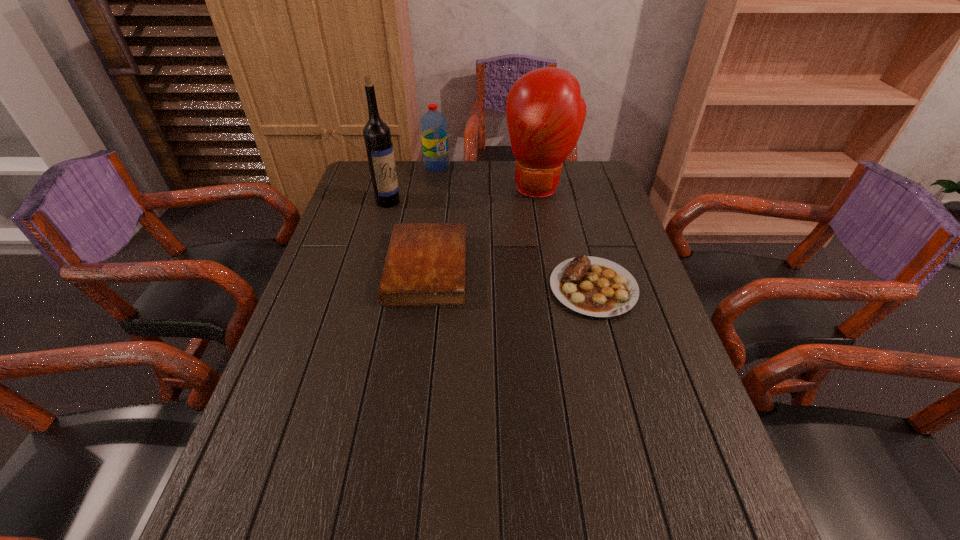
Find the location of `water bottle that is positioned at the far edge`. water bottle that is positioned at the far edge is located at coordinates (434, 133).

Locate an element on the screen. Image resolution: width=960 pixels, height=540 pixels. object that is positioned at the left edge is located at coordinates (379, 147).

This screenshot has height=540, width=960. I want to click on steak that is at the right edge, so click(592, 286).

The image size is (960, 540). Find the location of `boxing glove located in the right edge section of the desktop`. boxing glove located in the right edge section of the desktop is located at coordinates (545, 113).

You are a GUI agent. You are given a task and a screenshot of the screen. Output one action in this format:
    pyautogui.click(x=<x>, y=<y>)
    Task: Click on the object located in the far left corner section of the desktop
    This screenshot has width=960, height=540.
    Given the screenshot: What is the action you would take?
    pyautogui.click(x=379, y=147)

Image resolution: width=960 pixels, height=540 pixels. I want to click on object positioned at the far right corner, so click(545, 113).

Locate an element on the screen. blank area at the far edge is located at coordinates (497, 180).

Locate an element on the screen. This screenshot has width=960, height=540. vacant space at the near edge is located at coordinates (424, 445).

I want to click on blank area at the left edge, so click(322, 377).

The width and height of the screenshot is (960, 540). Identify the location of free point at the right edge. (653, 345).